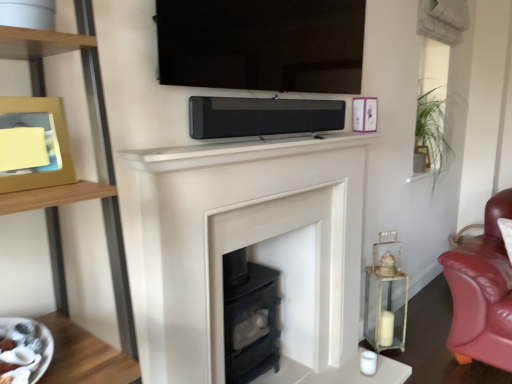
Where is `free point above white matte fireplace at center (from a real-world perspective)`? free point above white matte fireplace at center (from a real-world perspective) is located at coordinates click(270, 162).